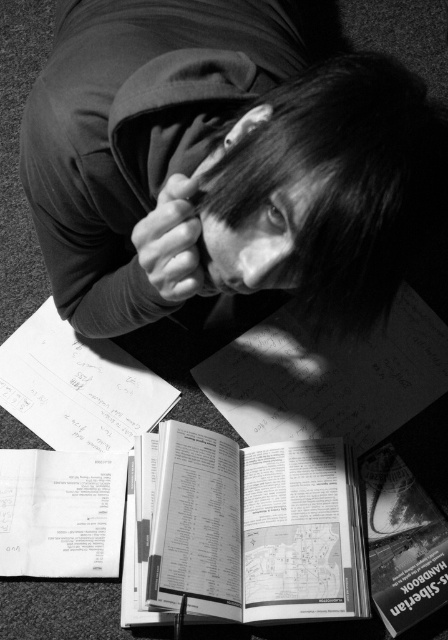
Between smooth hair at center and white paper at center, which one is positioned lower?

white paper at center

Who is positioned more to the right, smooth hair at center or white paper at center?

smooth hair at center is more to the right.

What do you see at coordinates (330, 182) in the screenshot?
I see `smooth hair at center` at bounding box center [330, 182].

This screenshot has height=640, width=448. Find the location of `smooth hair at center`. smooth hair at center is located at coordinates (330, 182).

Who is positioned more to the left, white paper at lower left or smooth skin hand at center?

white paper at lower left is more to the left.

Which of these two, white paper at lower left or smooth skin hand at center, stands shorter?

smooth skin hand at center is shorter.

Find the location of a particular element. Image resolution: width=448 pixels, height=640 pixels. white paper at lower left is located at coordinates (60, 513).

Who is lower down, white paper at center or white paper at lower left?

white paper at lower left is lower down.

Is white paper at center smaller than white paper at lower left?

No, white paper at center is not smaller than white paper at lower left.

At what (x,y) coordinates should I click in order to perform the action: click on white paper at center. Please return your answer as a coordinate pair (x, y). The image size is (448, 640). Looking at the image, I should click on (77, 387).